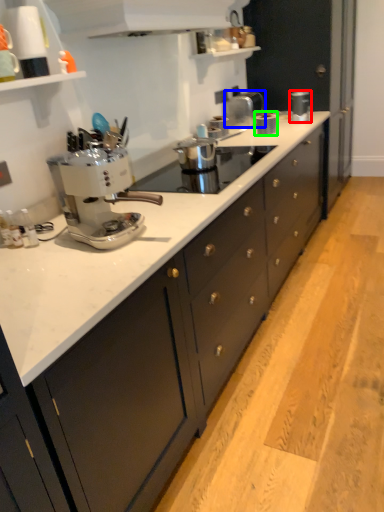
Question: Which is nearer to the kitchen appliance (highlighted by a red box)? appliance (highlighted by a blue box) or kitchen appliance (highlighted by a green box).

Choices:
 (A) appliance
 (B) kitchen appliance

Answer: (A)